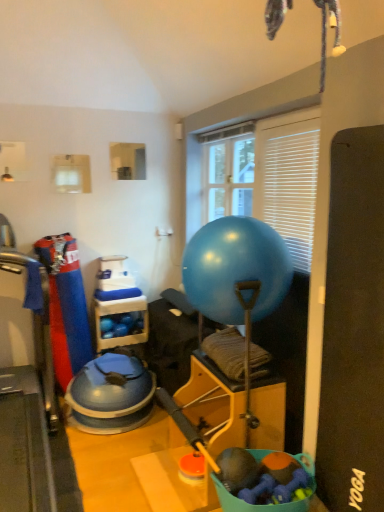
Question: Does blue rubber mat at left come behind rubberized fabric dog toy at lower center?

Choices:
 (A) no
 (B) yes

Answer: (A)

Question: From a real-world perspective, is blue rubber mat at left over rubberized fabric dog toy at lower center?

Choices:
 (A) yes
 (B) no

Answer: (A)

Question: From the image's perspective, is blue rubber mat at left under rubberized fabric dog toy at lower center?

Choices:
 (A) no
 (B) yes

Answer: (A)

Question: Is blue rubber mat at left located outside rubberized fabric dog toy at lower center?

Choices:
 (A) yes
 (B) no

Answer: (A)

Question: Is blue rubber mat at left wider than rubberized fabric dog toy at lower center?

Choices:
 (A) yes
 (B) no

Answer: (A)

Question: Considering the positions of rubberized fabric dog toy at lower center and transparent plastic window screen at center, the first window screen positioned from the back, in the image, is rubberized fabric dog toy at lower center taller or shorter than transparent plastic window screen at center, the first window screen positioned from the back,?

Choices:
 (A) short
 (B) tall

Answer: (A)

Question: From the image's perspective, relative to transparent plastic window screen at center, the first window screen positioned from the back, is rubberized fabric dog toy at lower center above or below?

Choices:
 (A) above
 (B) below

Answer: (B)

Question: From a real-world perspective, is rubberized fabric dog toy at lower center above or below transparent plastic window screen at center, the first window screen positioned from the back?

Choices:
 (A) above
 (B) below

Answer: (B)

Question: Is point (314, 485) closer or farther from the camera than point (225, 163)?

Choices:
 (A) farther
 (B) closer

Answer: (B)

Question: Is blue rubber ball at center bigger or smaller than blue rubber mat at left?

Choices:
 (A) small
 (B) big

Answer: (A)

Question: Is blue rubber ball at center inside or outside of blue rubber mat at left?

Choices:
 (A) inside
 (B) outside

Answer: (B)

Question: From their relative heights in the image, would you say blue rubber ball at center is taller or shorter than blue rubber mat at left?

Choices:
 (A) short
 (B) tall

Answer: (A)

Question: From a real-world perspective, is blue rubber ball at center above or below blue rubber mat at left?

Choices:
 (A) below
 (B) above

Answer: (B)

Question: Would you say blue rubber mat at left is to the left or to the right of rubberized fabric dog toy at lower center in the picture?

Choices:
 (A) left
 (B) right

Answer: (A)

Question: From a real-world perspective, is blue rubber mat at left above or below rubberized fabric dog toy at lower center?

Choices:
 (A) above
 (B) below

Answer: (A)